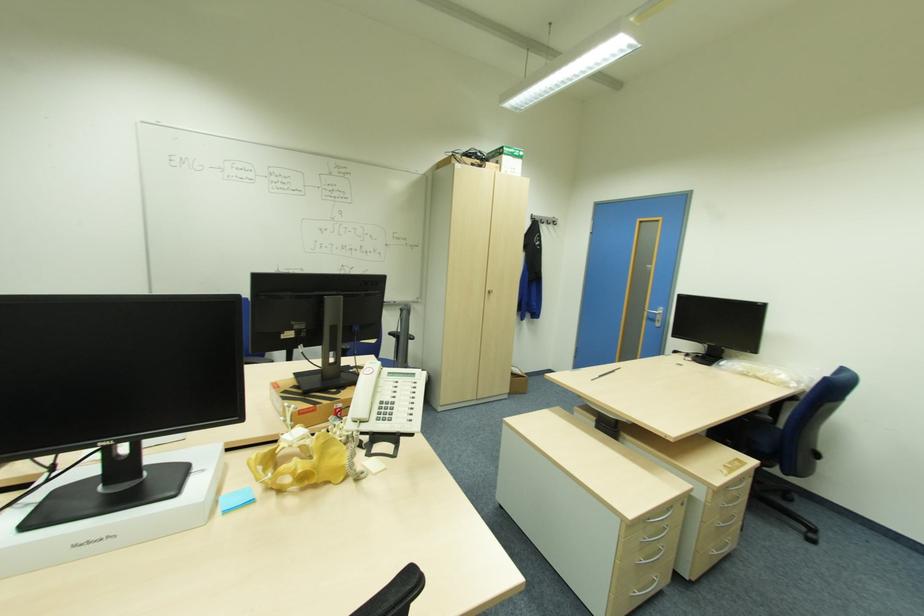
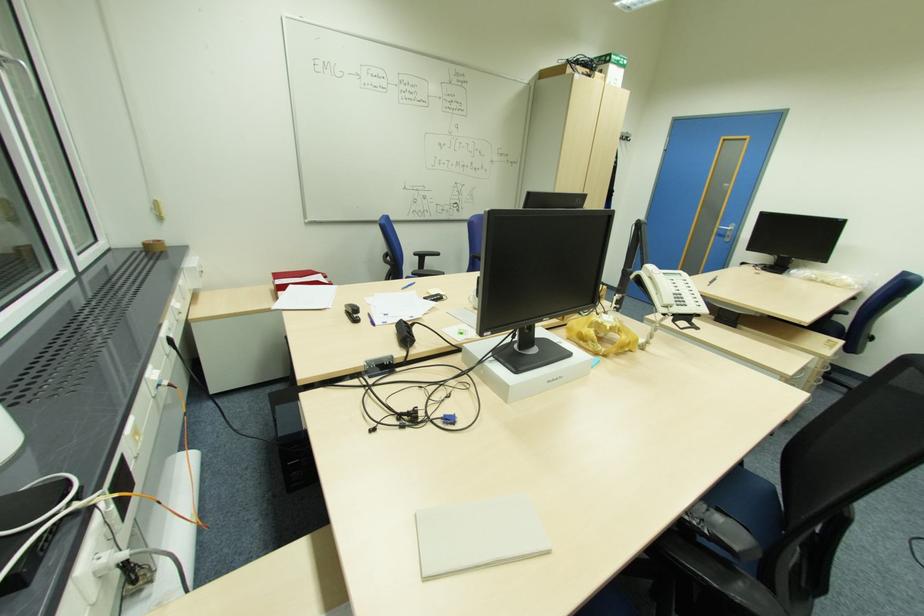
The point at [661,321] is marked in the first image. Where is the corresponding point in the second image?

(732, 236)